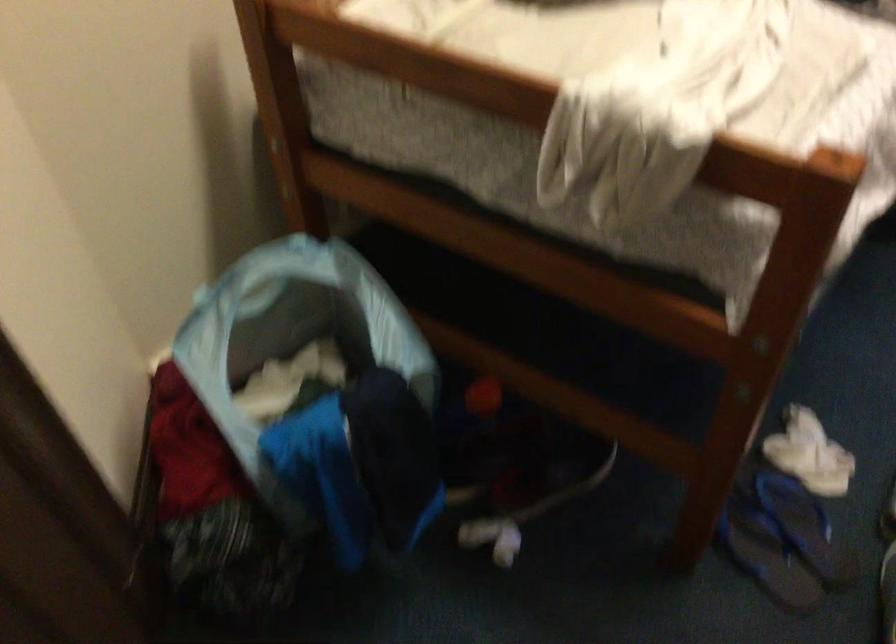
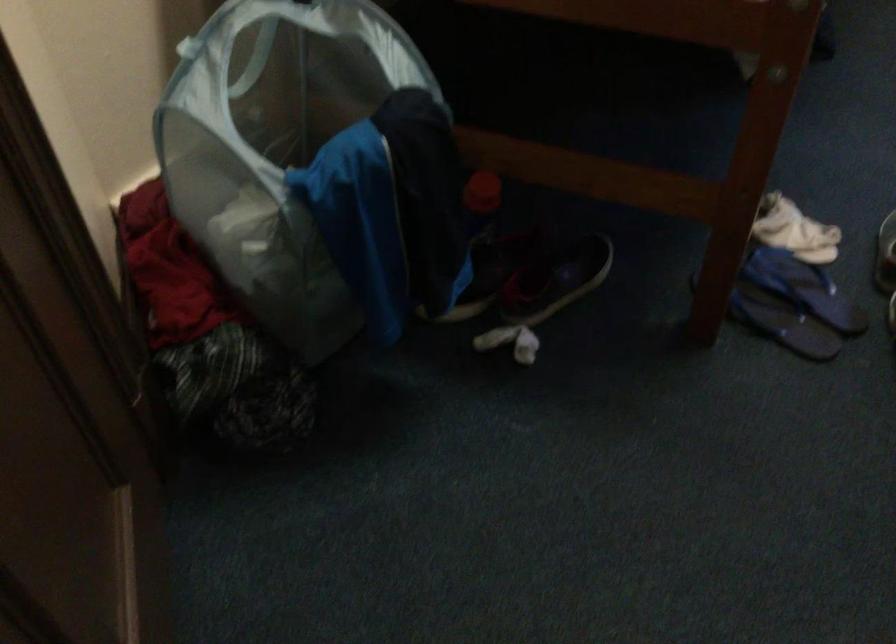
Find the pixel in the second image that matches point (493, 544) in the first image.

(510, 342)